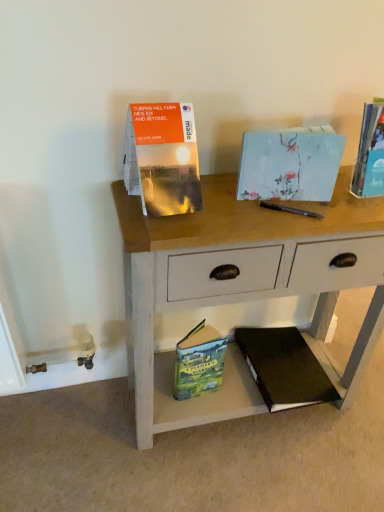
What do you see at coordinates (370, 154) in the screenshot? This screenshot has height=512, width=384. I see `hardcover book at upper right, the 5th paperback book when ordered from bottom to top` at bounding box center [370, 154].

How much space does hardcover book at upper right, positioned as the first paperback book in top-to-bottom order, occupy horizontally?

hardcover book at upper right, positioned as the first paperback book in top-to-bottom order, is 3.71 inches in width.

The image size is (384, 512). What do you see at coordinates (284, 368) in the screenshot?
I see `black hardcover book at lower right, arranged as the 1th paperback book when ordered from the bottom` at bounding box center [284, 368].

Find the location of `black hardcover book at lower right, the fifth paperback book viewed from the top`. black hardcover book at lower right, the fifth paperback book viewed from the top is located at coordinates (284, 368).

What are the coordinates of `matte orange map at upper left, the 3th paperback book positioned from the top` in the screenshot? It's located at (163, 158).

This screenshot has height=512, width=384. Find the location of `light blue paper at center, the 4th paperback book from the bottom`. light blue paper at center, the 4th paperback book from the bottom is located at coordinates (290, 164).

Which object is closer to the camera, matte orange map at upper left, the 3th paperback book positioned from the top, or hardcover book at upper right, the 5th paperback book when ordered from bottom to top?

matte orange map at upper left, the 3th paperback book positioned from the top, is more forward.

Is matte orange map at upper left, the third paperback book positioned from the bottom, spatially inside hardcover book at upper right, positioned as the first paperback book in top-to-bottom order, or outside of it?

matte orange map at upper left, the third paperback book positioned from the bottom, is not inside hardcover book at upper right, positioned as the first paperback book in top-to-bottom order, it's outside.

Where is `the 4th paperback book counting from the left of the hardcover book at upper right, positioned as the first paperback book in top-to-bottom order`? The image size is (384, 512). the 4th paperback book counting from the left of the hardcover book at upper right, positioned as the first paperback book in top-to-bottom order is located at coordinates [163, 158].

Is light blue paper at center, the second paperback book from the top, far from wooden desk at center?

No, light blue paper at center, the second paperback book from the top, is not far away from wooden desk at center.

From the image's perspective, is light blue paper at center, the second paperback book from the top, located above or below wooden desk at center?

Clearly, from the image's perspective, light blue paper at center, the second paperback book from the top, is above wooden desk at center.

From a real-world perspective, is light blue paper at center, the second paperback book from the top, on wooden desk at center?

Yes.

Can you confirm if light blue paper at center, the second paperback book from the top, is wider than wooden desk at center?

No.

In the scene shown: Does green matte paperback book at lower center, positioned as the fourth paperback book in top-to-bottom order, lie in front of wooden desk at center?

No, green matte paperback book at lower center, positioned as the fourth paperback book in top-to-bottom order, is further to the viewer.

Is green matte paperback book at lower center, placed as the second paperback book when sorted from bottom to top, positioned beyond the bounds of wooden desk at center?

No, green matte paperback book at lower center, placed as the second paperback book when sorted from bottom to top, is not entirely external to wooden desk at center.

Find the location of a particular element. This screenshot has width=384, height=512. desk above the green matte paperback book at lower center, positioned as the fourth paperback book in top-to-bottom order (from a real-world perspective) is located at coordinates (242, 287).

Are black hardcover book at lower right, the fifth paperback book viewed from the top, and hardcover book at upper right, positioned as the first paperback book in top-to-bottom order, making contact?

No, black hardcover book at lower right, the fifth paperback book viewed from the top, is not touching hardcover book at upper right, positioned as the first paperback book in top-to-bottom order.

You are a GUI agent. You are given a task and a screenshot of the screen. Output one action in this format:
    pyautogui.click(x=<x>, y=<y>)
    Task: Click on the 1st paperback book counting from the left side of the hardcover book at upper right, positioned as the first paperback book in top-to-bottom order
    
    Given the screenshot: What is the action you would take?
    pyautogui.click(x=284, y=368)

Choose the correct answer: Is black hardcover book at lower right, arranged as the 1th paperback book when ordered from the bottom, inside hardcover book at upper right, the 5th paperback book when ordered from bottom to top, or outside it?

black hardcover book at lower right, arranged as the 1th paperback book when ordered from the bottom, is not enclosed by hardcover book at upper right, the 5th paperback book when ordered from bottom to top.

Is black hardcover book at lower right, the fifth paperback book viewed from the top, aimed at hardcover book at upper right, the 5th paperback book when ordered from bottom to top?

No, black hardcover book at lower right, the fifth paperback book viewed from the top, is not aimed at hardcover book at upper right, the 5th paperback book when ordered from bottom to top.

How different are the orientations of light blue paper at center, the 4th paperback book from the bottom, and black hardcover book at lower right, the fifth paperback book viewed from the top, in degrees?

The facing directions of light blue paper at center, the 4th paperback book from the bottom, and black hardcover book at lower right, the fifth paperback book viewed from the top, are 5.52 degrees apart.

Are light blue paper at center, the 4th paperback book from the bottom, and black hardcover book at lower right, arranged as the 1th paperback book when ordered from the bottom, beside each other?

No, light blue paper at center, the 4th paperback book from the bottom, is not with black hardcover book at lower right, arranged as the 1th paperback book when ordered from the bottom.

Considering the relative positions of light blue paper at center, the 4th paperback book from the bottom, and black hardcover book at lower right, arranged as the 1th paperback book when ordered from the bottom, in the image provided, is light blue paper at center, the 4th paperback book from the bottom, to the left of black hardcover book at lower right, arranged as the 1th paperback book when ordered from the bottom, from the viewer's perspective?

Yes.

From a real-world perspective, which is physically above, light blue paper at center, the 4th paperback book from the bottom, or black hardcover book at lower right, arranged as the 1th paperback book when ordered from the bottom?

In real-world perspective, light blue paper at center, the 4th paperback book from the bottom, is above.

Looking at this image, is hardcover book at upper right, positioned as the first paperback book in top-to-bottom order, surrounded by wooden desk at center?

No.

In the scene shown: Is wooden desk at center turned away from hardcover book at upper right, the 5th paperback book when ordered from bottom to top?

No, hardcover book at upper right, the 5th paperback book when ordered from bottom to top, is not at the back of wooden desk at center.

From the image's perspective, who appears lower, wooden desk at center or hardcover book at upper right, the 5th paperback book when ordered from bottom to top?

wooden desk at center appears lower in the image.

From a real-world perspective, is wooden desk at center above or below hardcover book at upper right, positioned as the first paperback book in top-to-bottom order?

From a real-world perspective, wooden desk at center is physically below hardcover book at upper right, positioned as the first paperback book in top-to-bottom order.

How far apart are green matte paperback book at lower center, placed as the second paperback book when sorted from bottom to top, and hardcover book at upper right, the 5th paperback book when ordered from bottom to top?

The distance of green matte paperback book at lower center, placed as the second paperback book when sorted from bottom to top, from hardcover book at upper right, the 5th paperback book when ordered from bottom to top, is 25.09 inches.

From a real-world perspective, is green matte paperback book at lower center, placed as the second paperback book when sorted from bottom to top, positioned above or below hardcover book at upper right, the 5th paperback book when ordered from bottom to top?

green matte paperback book at lower center, placed as the second paperback book when sorted from bottom to top, is below hardcover book at upper right, the 5th paperback book when ordered from bottom to top.

Considering their positions, is green matte paperback book at lower center, positioned as the fourth paperback book in top-to-bottom order, located in front of or behind hardcover book at upper right, the 5th paperback book when ordered from bottom to top?

green matte paperback book at lower center, positioned as the fourth paperback book in top-to-bottom order, is positioned farther from the viewer than hardcover book at upper right, the 5th paperback book when ordered from bottom to top.

Is green matte paperback book at lower center, positioned as the fourth paperback book in top-to-bottom order, to the left of hardcover book at upper right, the 5th paperback book when ordered from bottom to top, from the viewer's perspective?

Yes, green matte paperback book at lower center, positioned as the fourth paperback book in top-to-bottom order, is to the left of hardcover book at upper right, the 5th paperback book when ordered from bottom to top.

Where is `the 2nd paperback book positioned above the matte orange map at upper left, the third paperback book positioned from the bottom (from the image's perspective)`? the 2nd paperback book positioned above the matte orange map at upper left, the third paperback book positioned from the bottom (from the image's perspective) is located at coordinates (370, 154).

Identify the location of desk below the light blue paper at center, the 4th paperback book from the bottom (from a real-world perspective). The height and width of the screenshot is (512, 384). (242, 287).

Estimate the real-world distances between objects in this image. Which object is closer to green matte paperback book at lower center, positioned as the fourth paperback book in top-to-bottom order, matte orange map at upper left, the 3th paperback book positioned from the top, or black hardcover book at lower right, the fifth paperback book viewed from the top?

Based on the image, black hardcover book at lower right, the fifth paperback book viewed from the top, appears to be nearer to green matte paperback book at lower center, positioned as the fourth paperback book in top-to-bottom order.

Looking at the image, which one is located further to matte orange map at upper left, the third paperback book positioned from the bottom, light blue paper at center, the 4th paperback book from the bottom, or green matte paperback book at lower center, positioned as the fourth paperback book in top-to-bottom order?

The object further to matte orange map at upper left, the third paperback book positioned from the bottom, is green matte paperback book at lower center, positioned as the fourth paperback book in top-to-bottom order.

Considering their positions, is matte orange map at upper left, the third paperback book positioned from the bottom, positioned closer to light blue paper at center, the second paperback book from the top, than wooden desk at center?

Among the two, matte orange map at upper left, the third paperback book positioned from the bottom, is located nearer to light blue paper at center, the second paperback book from the top.

Based on their spatial positions, is light blue paper at center, the 4th paperback book from the bottom, or matte orange map at upper left, the 3th paperback book positioned from the top, further from green matte paperback book at lower center, placed as the second paperback book when sorted from bottom to top?

Based on the image, matte orange map at upper left, the 3th paperback book positioned from the top, appears to be further to green matte paperback book at lower center, placed as the second paperback book when sorted from bottom to top.

Consider the image. Estimate the real-world distances between objects in this image. Which object is closer to wooden desk at center, black hardcover book at lower right, the fifth paperback book viewed from the top, or hardcover book at upper right, the 5th paperback book when ordered from bottom to top?

black hardcover book at lower right, the fifth paperback book viewed from the top, lies closer to wooden desk at center than the other object.

When comparing their distances from wooden desk at center, does black hardcover book at lower right, arranged as the 1th paperback book when ordered from the bottom, or matte orange map at upper left, the third paperback book positioned from the bottom, seem closer?

black hardcover book at lower right, arranged as the 1th paperback book when ordered from the bottom.

From the image, which object appears to be farther from black hardcover book at lower right, the fifth paperback book viewed from the top, hardcover book at upper right, the 5th paperback book when ordered from bottom to top, or wooden desk at center?

hardcover book at upper right, the 5th paperback book when ordered from bottom to top, lies further to black hardcover book at lower right, the fifth paperback book viewed from the top, than the other object.

Which object lies further to the anchor point wooden desk at center, light blue paper at center, the 4th paperback book from the bottom, or matte orange map at upper left, the third paperback book positioned from the bottom?

Based on the image, matte orange map at upper left, the third paperback book positioned from the bottom, appears to be further to wooden desk at center.

The width and height of the screenshot is (384, 512). What are the coordinates of `paperback book that lies between matte orange map at upper left, the third paperback book positioned from the bottom, and black hardcover book at lower right, arranged as the 1th paperback book when ordered from the bottom, from top to bottom` in the screenshot? It's located at (199, 362).

Identify the location of desk between hardcover book at upper right, positioned as the first paperback book in top-to-bottom order, and green matte paperback book at lower center, positioned as the fourth paperback book in top-to-bottom order, from top to bottom. (242, 287).

Find the location of a particular element. Image resolution: width=384 pixels, height=512 pixels. desk between hardcover book at upper right, the 5th paperback book when ordered from bottom to top, and black hardcover book at lower right, arranged as the 1th paperback book when ordered from the bottom, from top to bottom is located at coordinates pos(242,287).

The height and width of the screenshot is (512, 384). I want to click on desk between light blue paper at center, the 4th paperback book from the bottom, and green matte paperback book at lower center, positioned as the fourth paperback book in top-to-bottom order, in the vertical direction, so click(242, 287).